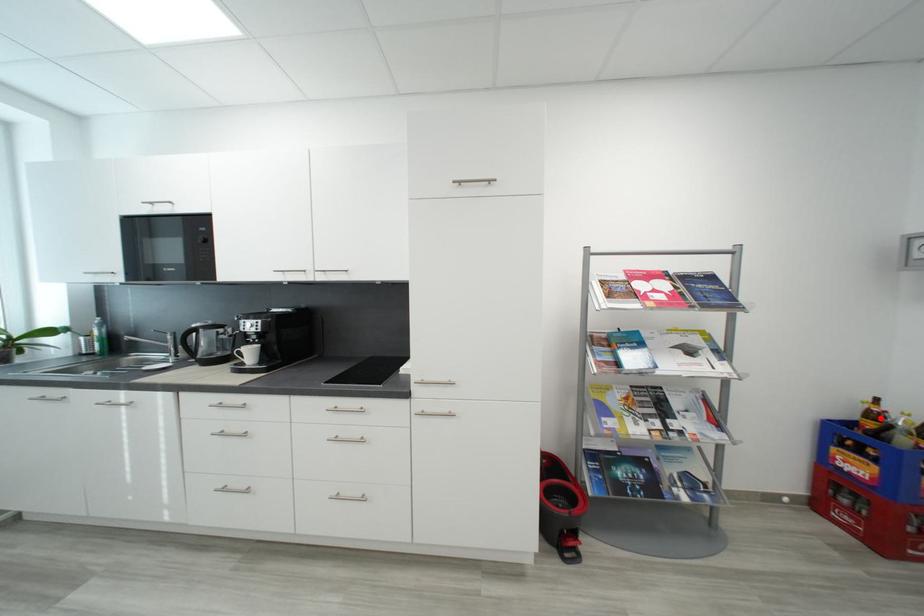
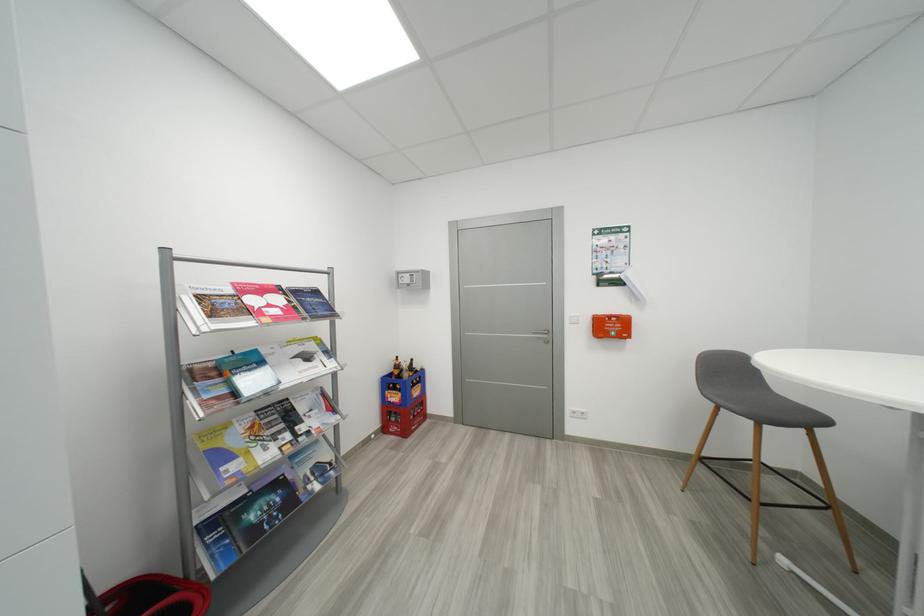
Question: I am providing you with two images of the same scene from different viewpoints. A red point is shown in image1. For the corresponding object point in image2, is it positioned nearer or farther from the camera?

Choices:
 (A) Nearer
 (B) Farther

Answer: (B)